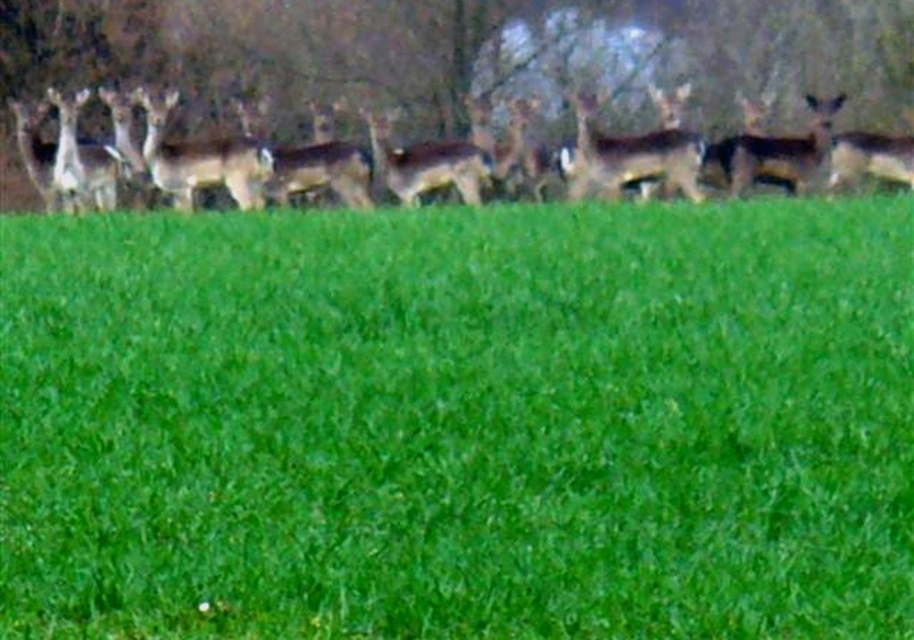
Question: Does brown matte deer at center come in front of brown matte/deer at center?

Choices:
 (A) no
 (B) yes

Answer: (B)

Question: Is brown matte deer at upper center to the right of brown matte deer at center from the viewer's perspective?

Choices:
 (A) no
 (B) yes

Answer: (A)

Question: Which object is positioned farthest from the brown matte deer at upper center?

Choices:
 (A) green grass at lower center
 (B) brown matte/deer at center
 (C) brown fur deer at center

Answer: (A)

Question: Can you confirm if brown matte deer at upper center is positioned to the right of brown matte/deer at center?

Choices:
 (A) no
 (B) yes

Answer: (B)

Question: Based on their relative distances, which object is farther from the brown matte deer at center?

Choices:
 (A) brown matte deer at upper right
 (B) green grass at lower center
 (C) brown matte/deer at center
 (D) brown matte deer at upper center

Answer: (B)

Question: Which object appears closest to the camera in this image?

Choices:
 (A) brown matte/deer at center
 (B) brown matte deer at center

Answer: (B)